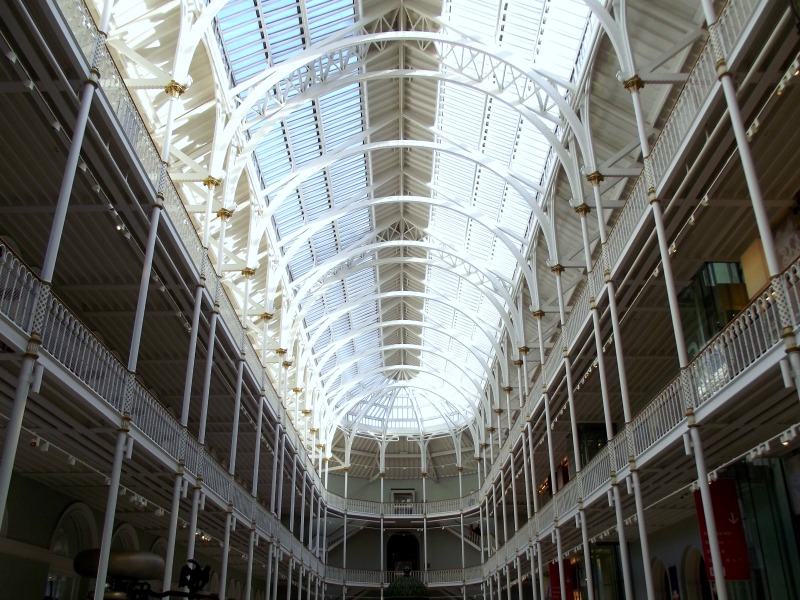
This screenshot has width=800, height=600. I want to click on staircases, so click(340, 537), click(472, 539).